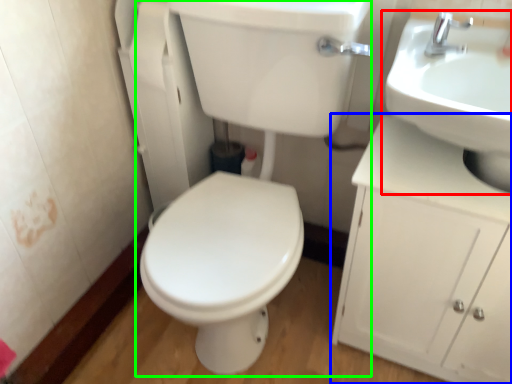
Question: Based on their relative distances, which object is nearer to sink (highlighted by a red box)? Choose from bathroom cabinet (highlighted by a blue box) and porcelain (highlighted by a green box).

Choices:
 (A) bathroom cabinet
 (B) porcelain

Answer: (A)